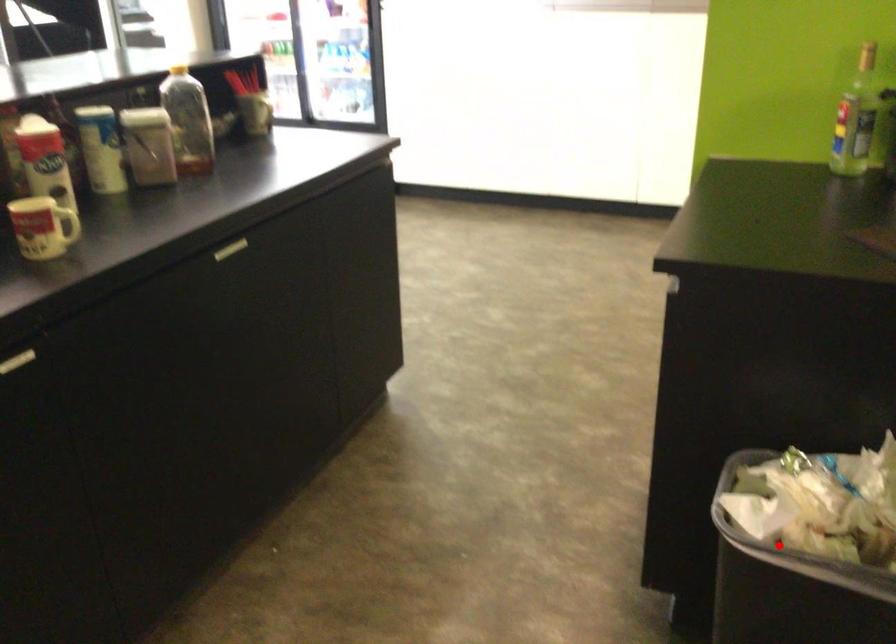
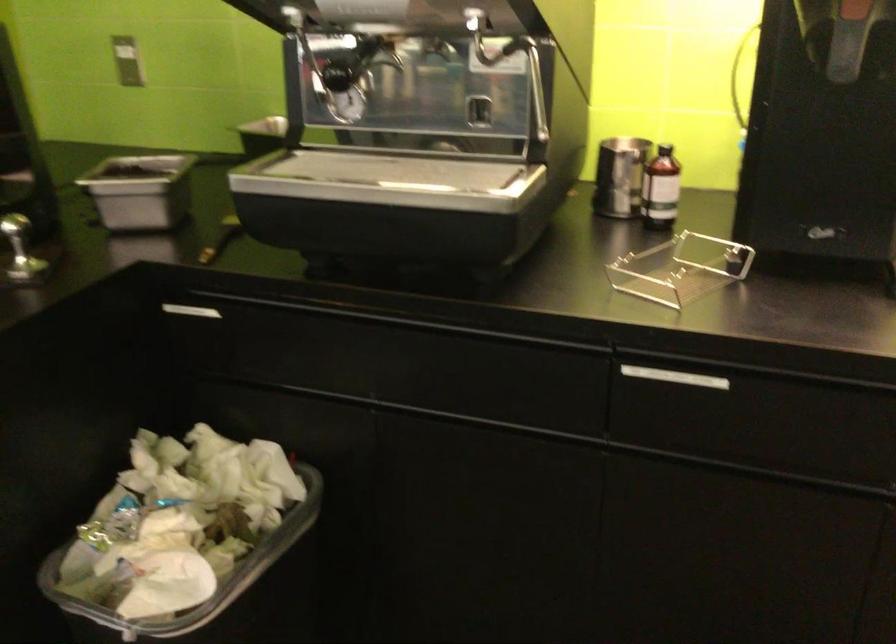
Locate, in the second image, the point that corresponds to the highlighted location in the first image.

(218, 592)